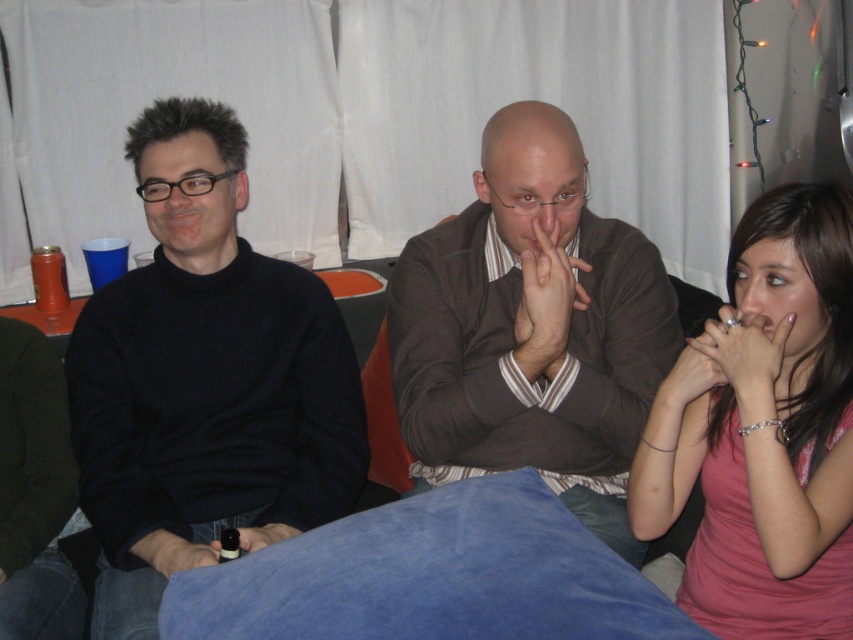
Question: Which point is closer to the camera?

Choices:
 (A) pink fabric shirt at right
 (B) black turtleneck sweater at left
 (C) brown sweater at center

Answer: (A)

Question: Does black turtleneck sweater at left have a smaller size compared to brown sweater at center?

Choices:
 (A) no
 (B) yes

Answer: (A)

Question: Where is brown sweater at center located in relation to pink fabric shirt at right in the image?

Choices:
 (A) below
 (B) above

Answer: (B)

Question: Can you confirm if black turtleneck sweater at left is wider than pink fabric shirt at right?

Choices:
 (A) yes
 (B) no

Answer: (A)

Question: Which point is closer to the camera?

Choices:
 (A) (573, 276)
 (B) (276, 337)
 (C) (726, 332)

Answer: (C)

Question: Which object appears farthest from the camera in this image?

Choices:
 (A) black turtleneck sweater at left
 (B) brown sweater at center

Answer: (B)